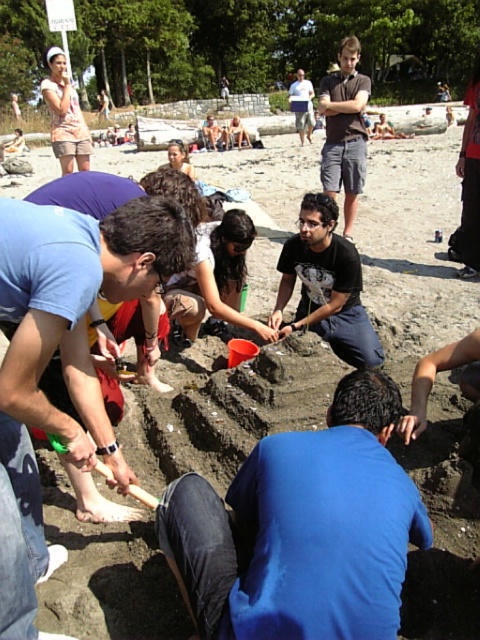
Is point (205, 296) farther from viewer compared to point (475, 221)?

No.

At what (x,y) coordinates should I click in order to perform the action: click on smooth brown sand at center. Please return your answer as a coordinate pair (x, y). The image size is (480, 640). Looking at the image, I should click on (207, 259).

This screenshot has width=480, height=640. Describe the element at coordinates (207, 259) in the screenshot. I see `smooth brown sand at center` at that location.

Where is `smooth brown sand at center`? This screenshot has height=640, width=480. smooth brown sand at center is located at coordinates (207, 259).

Is point (9, 349) closer to viewer compared to point (212, 234)?

Yes, it is.

What do you see at coordinates (62, 358) in the screenshot?
I see `blue cotton shirt at center` at bounding box center [62, 358].

Between point (14, 547) and point (193, 330), which one is positioned behind?

The point (193, 330) is more distant.

The height and width of the screenshot is (640, 480). Find the location of `blue cotton shirt at center`. blue cotton shirt at center is located at coordinates (62, 358).

Which is more to the left, blue matte shirt at center or red shirt at upper right?

Positioned to the left is blue matte shirt at center.

Does blue matte shirt at center appear on the right side of red shirt at upper right?

Incorrect, blue matte shirt at center is not on the right side of red shirt at upper right.

Between point (393, 492) and point (464, 209), which one is positioned behind?

The point (464, 209) is more distant.

This screenshot has height=640, width=480. In order to click on blue matte shirt at center in this screenshot , I will do `click(301, 529)`.